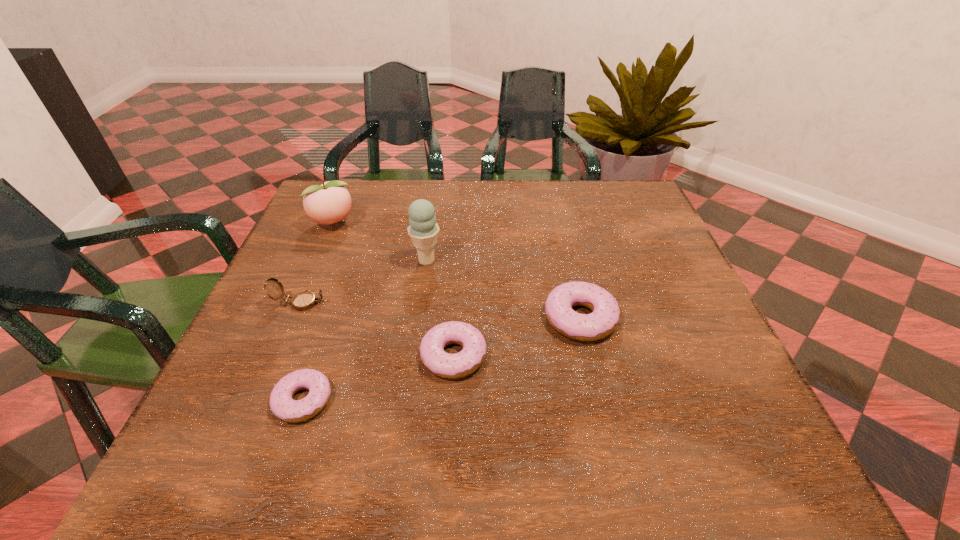
Locate an element on the screen. free space between the fifth nearest object and the fifth tallest object is located at coordinates (440, 308).

You are a GUI agent. You are given a task and a screenshot of the screen. Output one action in this format:
    pyautogui.click(x=<x>, y=<y>)
    Task: Click on the vacant area that lies between the fourth shortest object and the rightmost object
    
    Given the screenshot: What is the action you would take?
    pyautogui.click(x=441, y=310)

Where is `free spot between the compass and the rightmost object`? This screenshot has height=540, width=960. free spot between the compass and the rightmost object is located at coordinates (441, 310).

Locate an element on the screen. free space that is in between the rightmost doughnut and the second shortest object is located at coordinates (517, 336).

Locate an element on the screen. The width and height of the screenshot is (960, 540). vacant space in between the fourth shortest object and the ice cream is located at coordinates (364, 282).

Find the location of a particular element. The height and width of the screenshot is (540, 960). free space between the tallest doughnut and the compass is located at coordinates (441, 310).

Locate an element on the screen. Image resolution: width=960 pixels, height=540 pixels. vacant area between the fifth shortest object and the third tallest object is located at coordinates (317, 263).

You are a GUI agent. You are given a task and a screenshot of the screen. Output one action in this format:
    pyautogui.click(x=<x>, y=<y>)
    Task: Click on the free space between the second doughnut from right to left and the shortest object
    The image size is (960, 540).
    Given the screenshot: What is the action you would take?
    pyautogui.click(x=378, y=377)

Find the location of a particular element. This screenshot has height=540, width=960. vacant point located between the shortest object and the second farthest object is located at coordinates (365, 330).

Find the location of a particular element. The width and height of the screenshot is (960, 540). object that is the second closest to the ice cream is located at coordinates (305, 300).